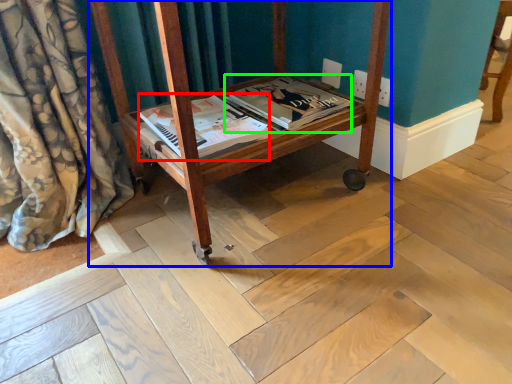
Question: Which object is the farthest from magazine (highlighted by a red box)? Choose among these: furniture (highlighted by a blue box) or magazine (highlighted by a green box).

Choices:
 (A) furniture
 (B) magazine

Answer: (A)